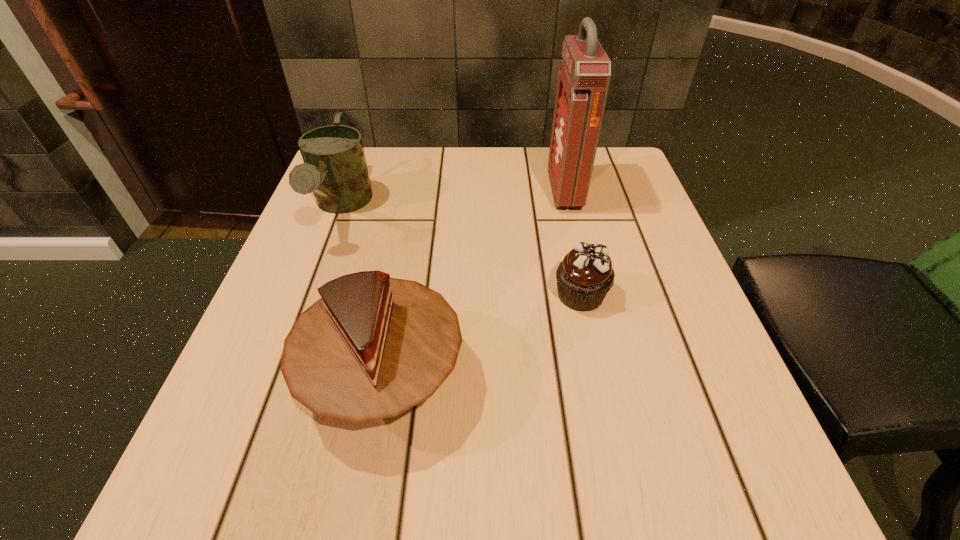
Locate an element on the screen. Image resolution: width=960 pixels, height=540 pixels. vacant region at the far edge of the desktop is located at coordinates (448, 192).

Where is `blank area at the near edge`? The height and width of the screenshot is (540, 960). blank area at the near edge is located at coordinates (456, 465).

In the image, there is a desktop. Identify the location of vacant space at the left edge. (315, 427).

This screenshot has height=540, width=960. I want to click on vacant space at the right edge, so click(595, 215).

The height and width of the screenshot is (540, 960). Find the location of `vacant space that's between the shortest object and the first-aid kit`. vacant space that's between the shortest object and the first-aid kit is located at coordinates (572, 243).

The width and height of the screenshot is (960, 540). I want to click on free space between the shortest object and the watering can, so click(461, 251).

You are a GUI agent. You are given a task and a screenshot of the screen. Output one action in this format:
    pyautogui.click(x=<x>, y=<y>)
    Task: Click on the free spot between the watering can and the first-aid kit
    This screenshot has width=960, height=540.
    Given the screenshot: What is the action you would take?
    pyautogui.click(x=453, y=199)

Where is `vacant area that lies between the watering can and the shortest object`? This screenshot has height=540, width=960. vacant area that lies between the watering can and the shortest object is located at coordinates (461, 251).

What are the coordinates of `free space that is in between the watering can and the shortest object` in the screenshot? It's located at (461, 251).

The width and height of the screenshot is (960, 540). I want to click on vacant area that lies between the shortest object and the watering can, so click(461, 251).